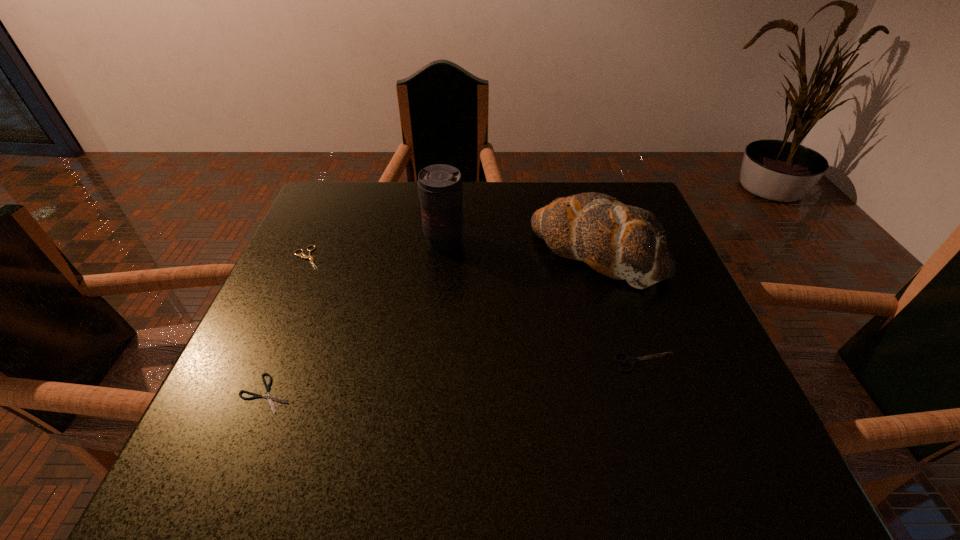
This screenshot has width=960, height=540. Identify the location of free space between the second farthest shears and the farthest shears. pos(476,310).

Identify the location of empty space between the shortest object and the bread. The height and width of the screenshot is (540, 960). (431, 322).

The image size is (960, 540). I want to click on blank region between the third shortest object and the nearest shears, so [x=456, y=378].

This screenshot has width=960, height=540. In order to click on free space between the fourth shortest object and the second nearest object in this screenshot , I will do `click(621, 307)`.

At what (x,y) coordinates should I click in order to perform the action: click on object that is the second closest to the tallest shears. Please return your answer as a coordinate pair (x, y). Image resolution: width=960 pixels, height=540 pixels. Looking at the image, I should click on (440, 187).

I want to click on object that stands as the closest to the bread, so click(x=630, y=361).

Where is `shears that is the second closest one to the tallest object`? shears that is the second closest one to the tallest object is located at coordinates (268, 396).

Identify which shears is the second nearest to the rightmost shears. Please provide its 2D coordinates. Your answer should be formatted as a tuple, i.e. [(x, y)], where the tuple contains the x and y coordinates of a point satisfying the conditions above.

[(304, 256)]

Locate an element on the screen. free point that satisfies the following two spatial constraints: 1. on the back side of the farthest shears; 2. on the left side of the fourth shortest object is located at coordinates (310, 252).

You are a GUI agent. You are given a task and a screenshot of the screen. Output one action in this format:
    pyautogui.click(x=<x>, y=<y>)
    Task: Click on the blank space that satisfies the following two spatial constraints: 1. on the back side of the third tallest object; 2. on the right side of the nearest shears
    
    Given the screenshot: What is the action you would take?
    pyautogui.click(x=278, y=362)